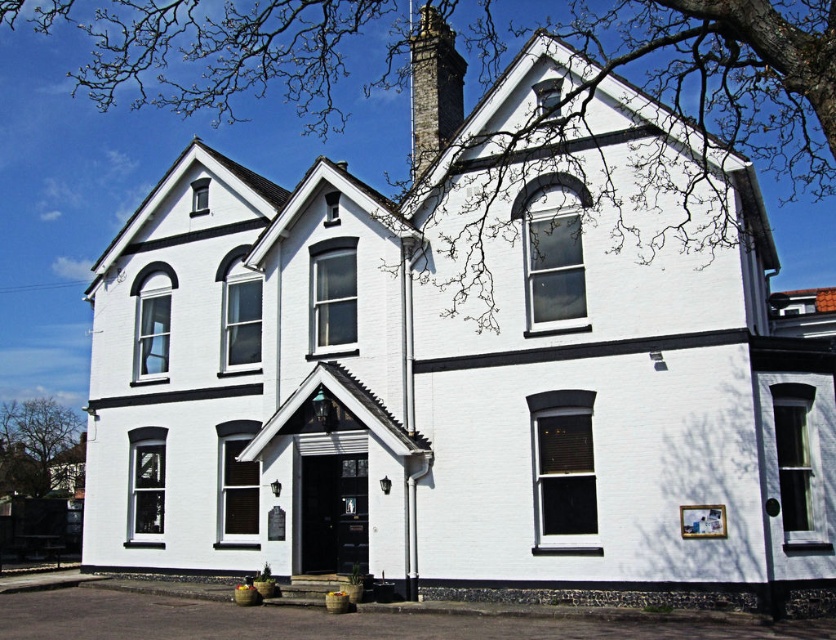
You are standing in front of the two story white brick building. You see a point at coordinates (432, 88). What is located at that point?

The point at coordinates (432, 88) is where the stone chimney at upper center is located.

You are standing in front of the two story white brick building. You notice both the bare branches at upper center and the stone chimney at upper center. Which object is bigger in size?

The bare branches at upper center is larger in size than the stone chimney at upper center.